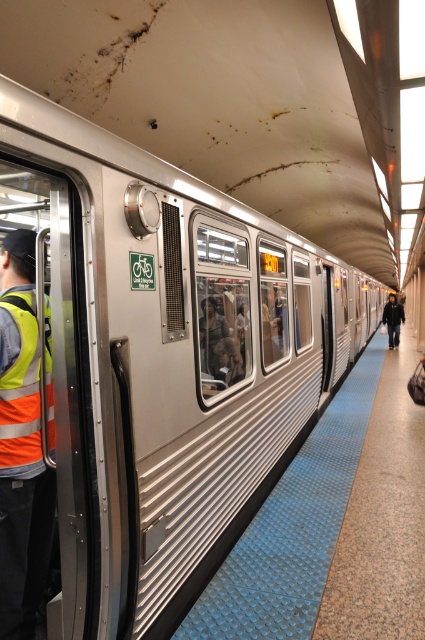
You are standing on the subway platform and see two points marked on the train doors. The first point is at point (22, 364) and the second is at point (393, 298). Which point is closer to you as you face the train?

Point (22, 364) is closer to the viewer than point (393, 298).